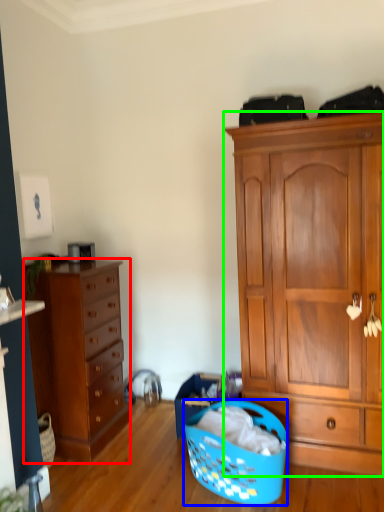
Question: Which object is positioned farthest from chest of drawers (highlighted by a red box)? Select from picnic basket (highlighted by a blue box) and cabinetry (highlighted by a green box).

Choices:
 (A) picnic basket
 (B) cabinetry

Answer: (B)